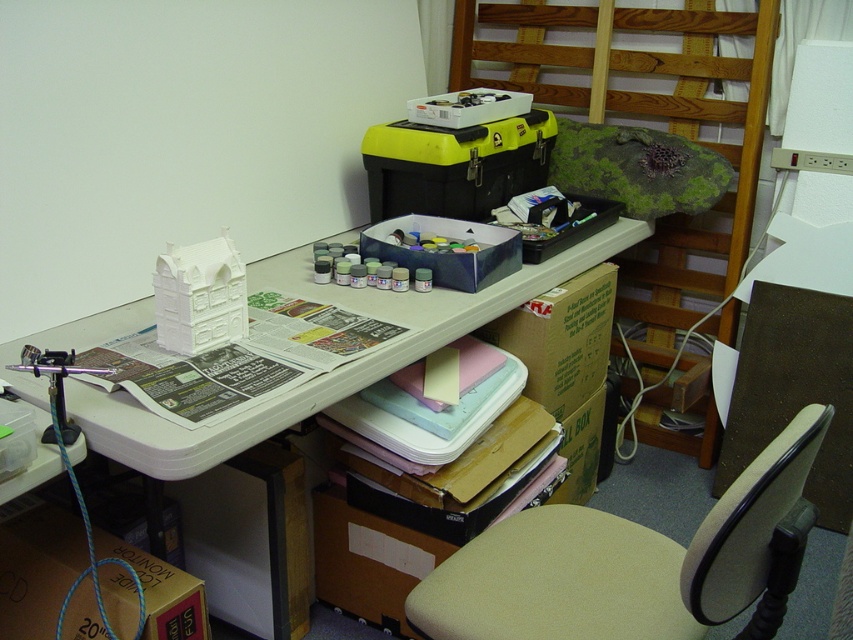
Question: Where is beige fabric swivel chair at lower right located in relation to white plastic desk at upper center in the image?

Choices:
 (A) right
 (B) left

Answer: (A)

Question: Does beige fabric swivel chair at lower right appear on the left side of white plastic desk at upper center?

Choices:
 (A) no
 (B) yes

Answer: (A)

Question: Which object is closer to the camera taking this photo?

Choices:
 (A) beige fabric swivel chair at lower right
 (B) white plastic desk at upper center

Answer: (A)

Question: Does beige fabric swivel chair at lower right have a larger size compared to white plastic desk at upper center?

Choices:
 (A) no
 (B) yes

Answer: (A)

Question: Which point is farther to the camera?

Choices:
 (A) (751, 481)
 (B) (281, 422)

Answer: (B)